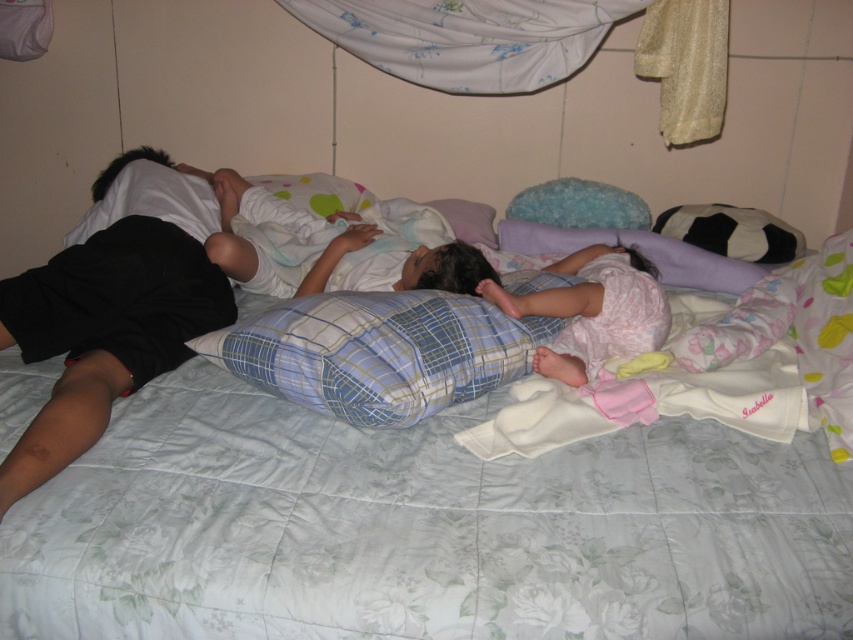
You are a parent trying to make sure your children have enough space to sleep comfortably on the bed. You notice the matte black pillow at left and the white soft blanket at center. Which item takes up more vertical space on the bed?

The matte black pillow at left is taller than the white soft blanket at center, so it takes up more vertical space on the bed.

You are standing at the head of the bed in the cozy indoor scene. You notice two points marked on the bed. Which point is closer to you, point (685, 296) or point (543, 317)?

Point (543, 317) is closer to you because it is in front of point (685, 296).

You are trying to find the matte black pillow at left and the white soft blanket at center in the image. According to the scene description, which object is positioned more to the left?

The matte black pillow at left is positioned more to the left than the white soft blanket at center.